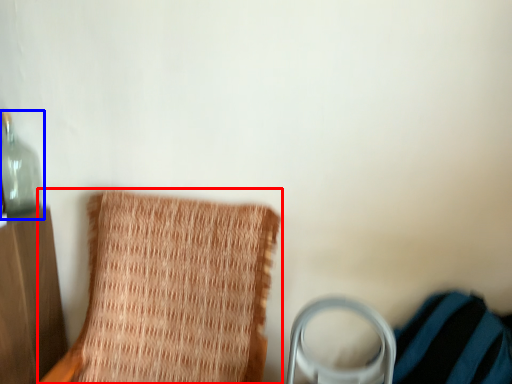
Question: Among these objects, which one is farthest to the camera, furniture (highlighted by a red box) or bottle (highlighted by a blue box)?

Choices:
 (A) furniture
 (B) bottle

Answer: (B)